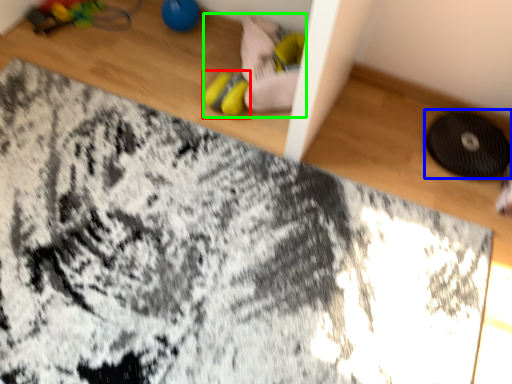
Question: Based on their relative distances, which object is nearer to footwear (highlighted by a red box)? Choose from mat (highlighted by a blue box) and toy (highlighted by a green box).

Choices:
 (A) mat
 (B) toy

Answer: (B)